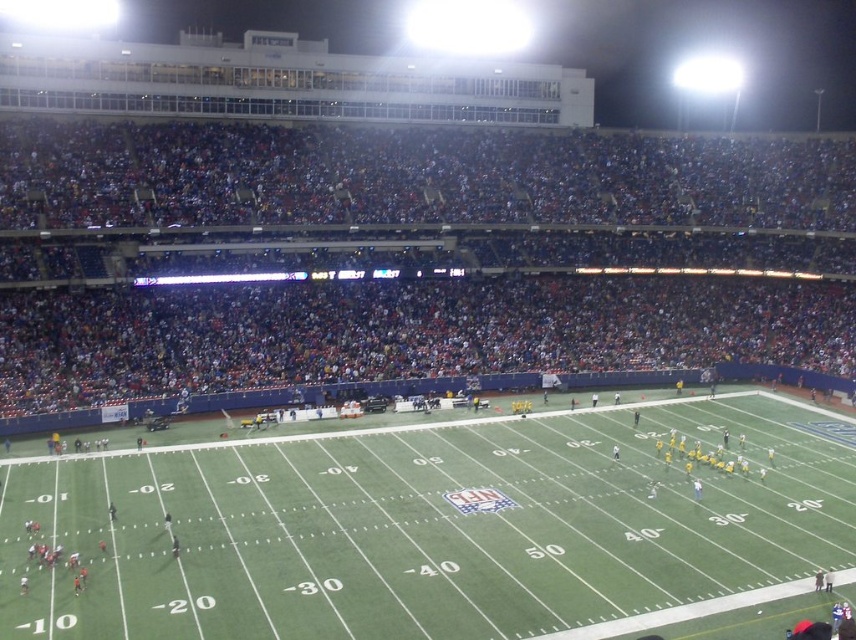
Question: Among these points, which one is farthest from the camera?

Choices:
 (A) (167, 532)
 (B) (78, 176)

Answer: (B)

Question: Can you confirm if green turf football field at center is positioned below dark blue seats at upper center?

Choices:
 (A) no
 (B) yes

Answer: (B)

Question: Which point is farther from the camera taking this photo?

Choices:
 (A) (527, 524)
 (B) (171, 172)

Answer: (B)

Question: Can you confirm if green turf football field at center is smaller than dark blue seats at upper center?

Choices:
 (A) no
 (B) yes

Answer: (B)

Question: From the image, what is the correct spatial relationship of green turf football field at center in relation to dark blue seats at upper center?

Choices:
 (A) below
 (B) above

Answer: (A)

Question: Which point is closer to the camera?

Choices:
 (A) dark blue seats at upper center
 (B) green turf football field at center

Answer: (B)